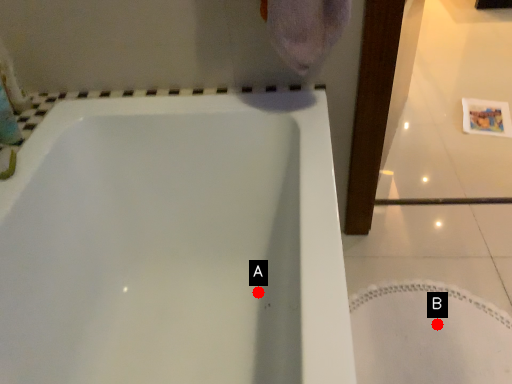
Question: Two points are circled on the image, labeled by A and B beside each circle. Which of the following is the closest to the observer?

Choices:
 (A) A is closer
 (B) B is closer

Answer: (A)